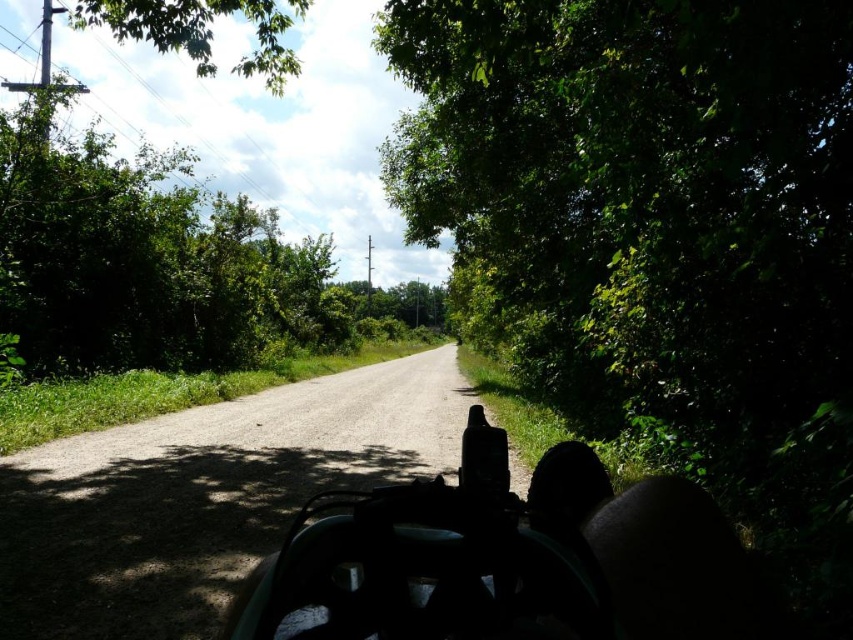
Does green plastic baby carriage at center have a larger size compared to green leafy tree at upper center?

Incorrect, green plastic baby carriage at center is not larger than green leafy tree at upper center.

Can you confirm if green plastic baby carriage at center is positioned above green leafy tree at upper center?

Incorrect, green plastic baby carriage at center is not positioned above green leafy tree at upper center.

Locate an element on the screen. The height and width of the screenshot is (640, 853). green plastic baby carriage at center is located at coordinates (505, 557).